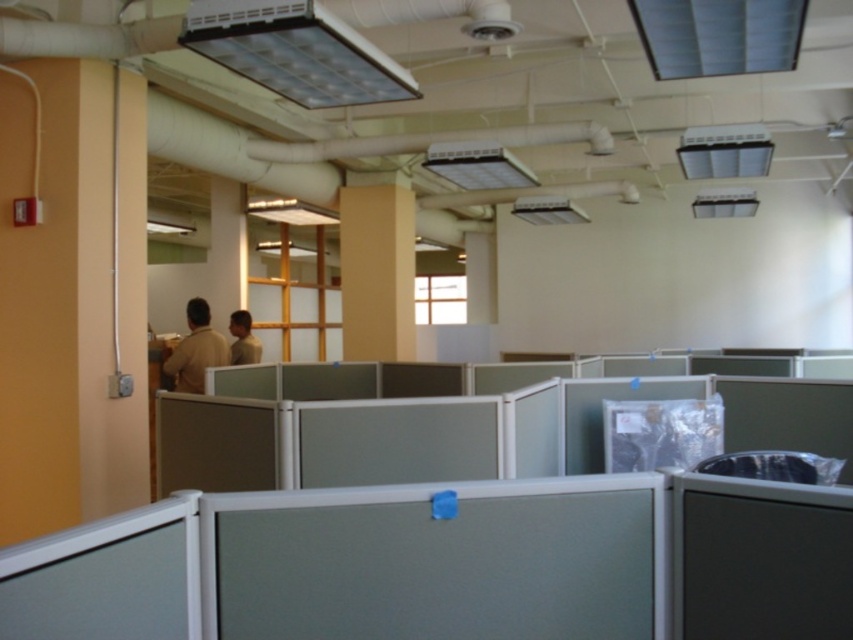
Question: Can you confirm if matte wood pillar at center is smaller than light brown shirt at center?

Choices:
 (A) no
 (B) yes

Answer: (A)

Question: Estimate the real-world distances between objects in this image. Which object is farther from the light brown shirt at center?

Choices:
 (A) matte wood pillar at upper center
 (B) brown matte shirt at left
 (C) matte wood pillar at center

Answer: (C)

Question: Can you confirm if matte wood pillar at upper center is smaller than light brown shirt at center?

Choices:
 (A) yes
 (B) no

Answer: (B)

Question: Considering the relative positions of matte wood pillar at upper center and light brown shirt at center in the image provided, where is matte wood pillar at upper center located with respect to light brown shirt at center?

Choices:
 (A) right
 (B) left

Answer: (B)

Question: Which object is closer to the camera taking this photo?

Choices:
 (A) matte wood pillar at upper center
 (B) matte wood pillar at center
 (C) brown matte shirt at left

Answer: (C)

Question: Estimate the real-world distances between objects in this image. Which object is farther from the matte wood pillar at center?

Choices:
 (A) light brown shirt at center
 (B) brown matte shirt at left
 (C) matte wood pillar at upper center

Answer: (B)